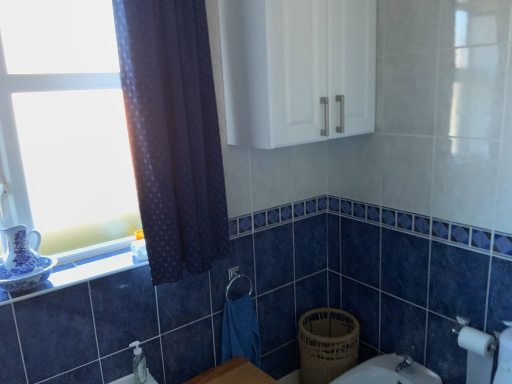
Question: Considering the positions of point click(164, 150) and point click(139, 263), is point click(164, 150) closer or farther from the camera than point click(139, 263)?

Choices:
 (A) closer
 (B) farther

Answer: (A)

Question: Do you think dark blue sheer curtain at left is within white glossy window sill at lower left, or outside of it?

Choices:
 (A) inside
 (B) outside

Answer: (B)

Question: Considering the real-world distances, which object is closest to the clear plastic soap dispenser at lower center?

Choices:
 (A) white glass window at left
 (B) blue porcelain tea pot at left
 (C) white glossy window sill at lower left
 (D) white glossy cabinet at upper center
 (E) dark blue sheer curtain at left

Answer: (C)

Question: Considering the real-world distances, which object is farthest from the white glossy window sill at lower left?

Choices:
 (A) white matte toilet paper at lower right
 (B) blue porcelain tea pot at left
 (C) woven brown basket at lower right
 (D) white glossy cabinet at upper center
 (E) blue fabric hand towel at lower center

Answer: (A)